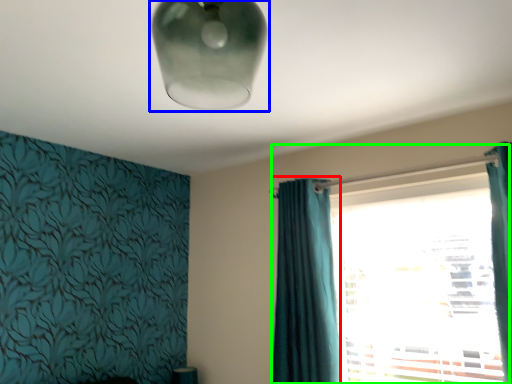
Question: Based on their relative distances, which object is farther from curtain (highlighted by a red box)? Choose from lamp (highlighted by a blue box) and window (highlighted by a green box).

Choices:
 (A) lamp
 (B) window

Answer: (A)